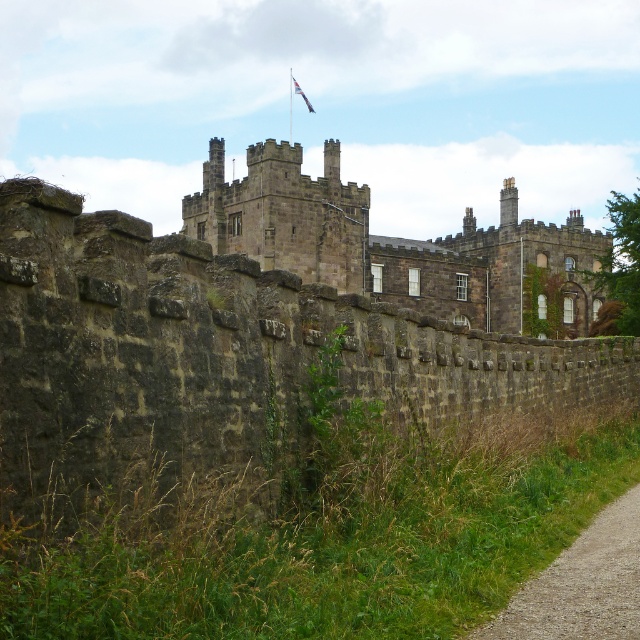
Is gravel path at lower right positioned at the back of blue fabric flag at upper center?

No.

Who is more distant from viewer, (627,564) or (307,106)?

Point (307,106)

What do you see at coordinates (582, 584) in the screenshot?
I see `gravel path at lower right` at bounding box center [582, 584].

At what (x,y) coordinates should I click in order to perform the action: click on gravel path at lower right. Please return your answer as a coordinate pair (x, y). Looking at the image, I should click on (582, 584).

Is the position of dark stone castle at center less distant than that of gravel path at lower right?

No.

Is dark stone castle at center to the right of gravel path at lower right from the viewer's perspective?

Yes, dark stone castle at center is to the right of gravel path at lower right.

Where is `dark stone castle at center`? dark stone castle at center is located at coordinates (392, 243).

Image resolution: width=640 pixels, height=640 pixels. Identify the location of dark stone castle at center. click(x=392, y=243).

Can you confirm if dark stone castle at center is positioned above blue fabric flag at upper center?

No, dark stone castle at center is not above blue fabric flag at upper center.

Can you confirm if dark stone castle at center is positioned below blue fabric flag at upper center?

Indeed, dark stone castle at center is positioned under blue fabric flag at upper center.

The height and width of the screenshot is (640, 640). In order to click on dark stone castle at center in this screenshot , I will do `click(392, 243)`.